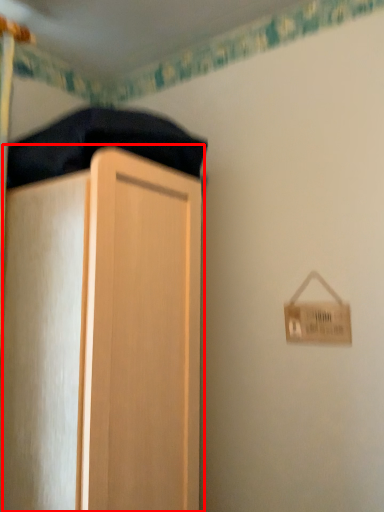
Question: From the image's perspective, what is the correct spatial positioning of cupboard (annotated by the red box) in reference to bedding?

Choices:
 (A) above
 (B) below

Answer: (B)